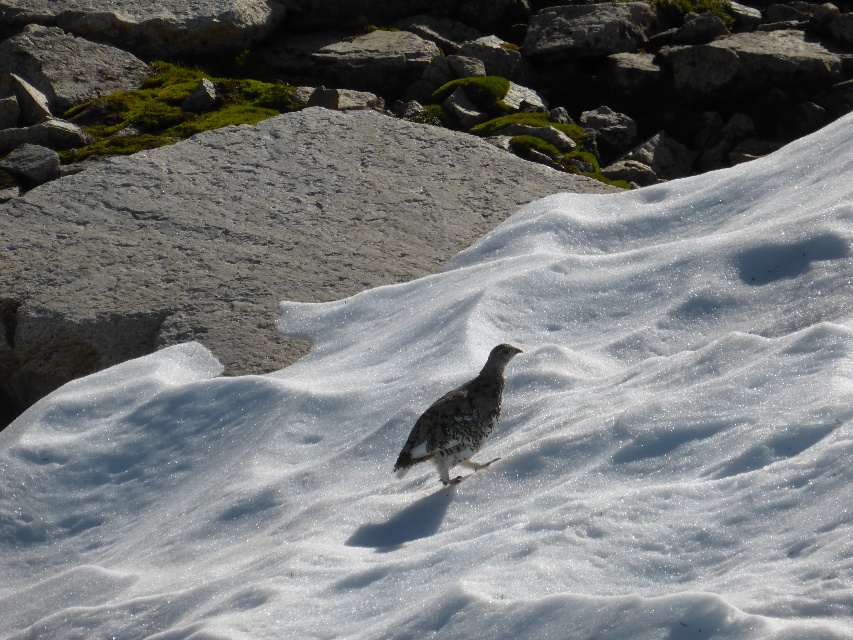
Looking at this image, you are standing at the edge of the snowy landscape and see the point marked at coordinate (x=236, y=237). What object is located at that point?

The point at coordinate (x=236, y=237) marks a gray rough rock at center.

You are a photographer trying to capture the speckled white bird at center and the gray rough rock at center in the same frame. Based on their sizes, which object would appear larger in your photo?

The gray rough rock at center would appear larger in the photo since it is much taller than the speckled white bird at center.